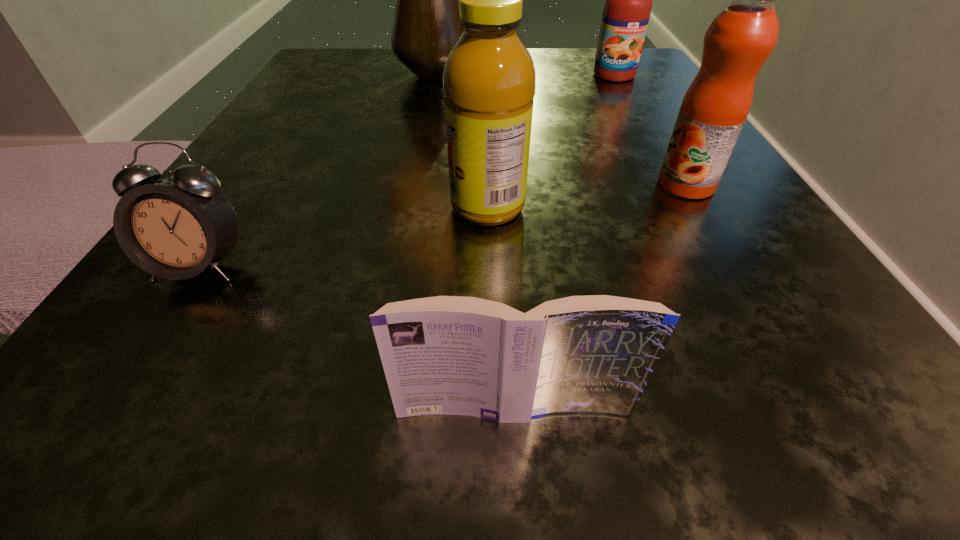
This screenshot has width=960, height=540. What are the coordinates of `vacant space at the near edge of the desktop` in the screenshot? It's located at (416, 456).

Where is `free location at the left edge of the desktop`? free location at the left edge of the desktop is located at coordinates (291, 144).

I want to click on free space at the right edge of the desktop, so click(633, 185).

The height and width of the screenshot is (540, 960). Find the location of `free location at the far left corner`. free location at the far left corner is located at coordinates (340, 63).

In the image, there is a desktop. Where is `vacant area at the near left corner`? vacant area at the near left corner is located at coordinates (176, 367).

Locate an element on the screen. The height and width of the screenshot is (540, 960). blank space at the near right corner of the desktop is located at coordinates (772, 410).

You are a GUI agent. You are given a task and a screenshot of the screen. Output one action in this format:
    pyautogui.click(x=<x>, y=<y>)
    Task: Click on the empty location between the leftmost fruit juice and the fifth farthest object
    This screenshot has width=960, height=540.
    Given the screenshot: What is the action you would take?
    pyautogui.click(x=345, y=237)

Identify the location of vacant area between the alarm clock and the leftmost fruit juice. The image size is (960, 540). (345, 237).

The width and height of the screenshot is (960, 540). What are the coordinates of `free space between the second nearest object and the lampshade` in the screenshot? It's located at (319, 171).

What are the coordinates of `free space between the leftmost fruit juice and the leftmost object` in the screenshot? It's located at (345, 237).